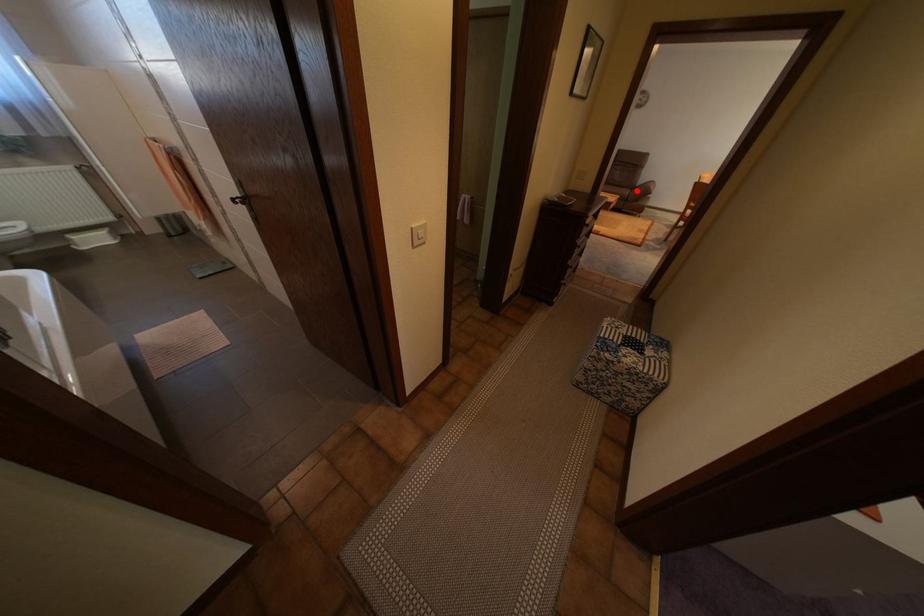
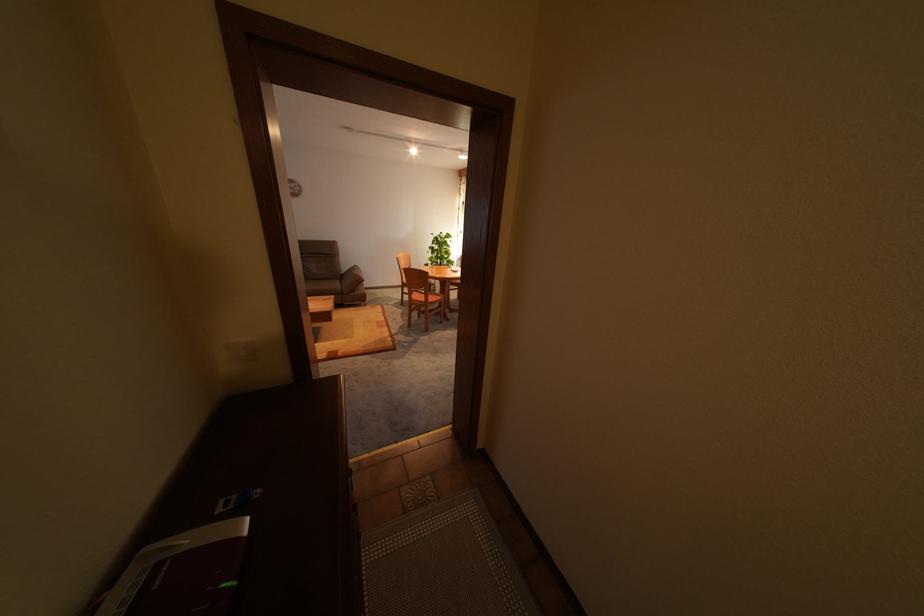
Question: I am providing you with two images of the same scene from different viewpoints. A red point is shown in image1. For the corresponding object point in image2, is it positioned nearer or farther from the camera?

Choices:
 (A) Nearer
 (B) Farther

Answer: (A)